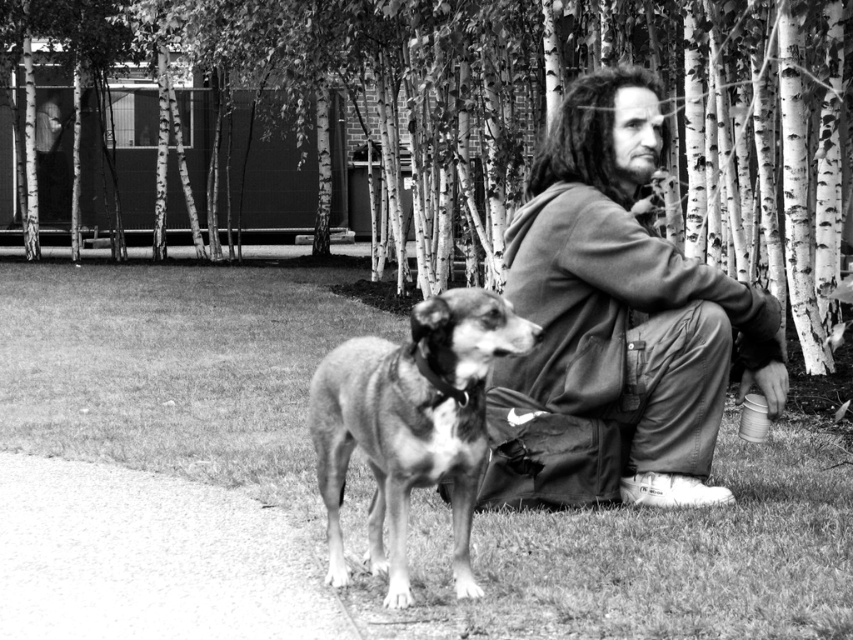
Can you confirm if ripped denim jacket at center is thinner than spotted fur dog at center?

Incorrect, ripped denim jacket at center's width is not less than spotted fur dog at center's.

Does ripped denim jacket at center have a lesser height compared to spotted fur dog at center?

Incorrect, ripped denim jacket at center's height does not fall short of spotted fur dog at center's.

This screenshot has height=640, width=853. In order to click on ripped denim jacket at center in this screenshot , I will do `click(614, 323)`.